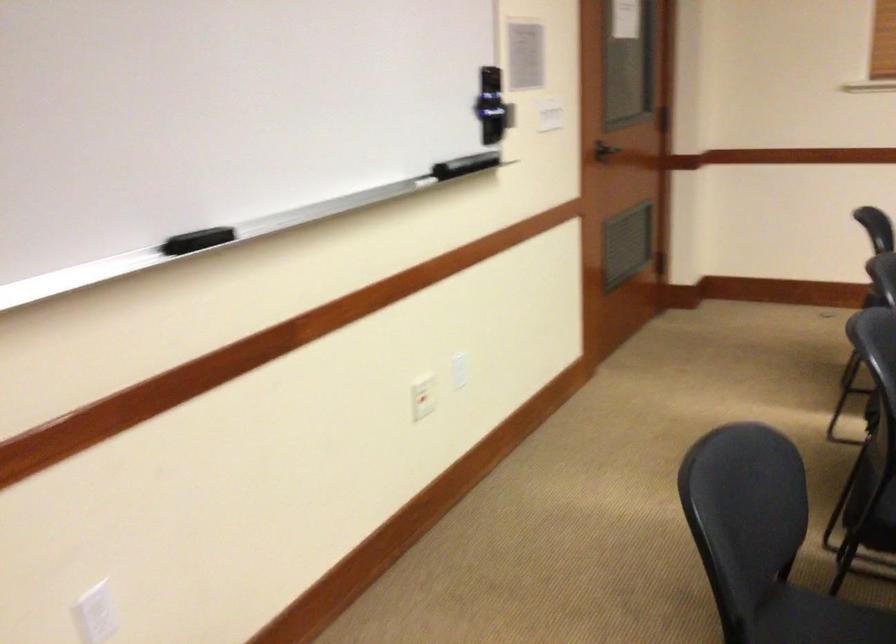
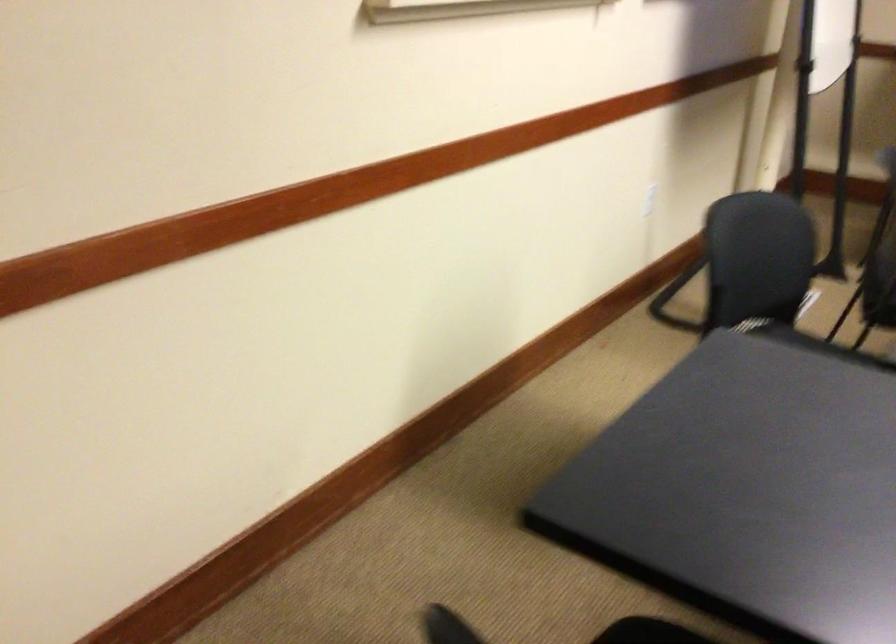
Question: What movement of the cameraman would produce the second image?

Choices:
 (A) Left
 (B) Right
 (C) Forward
 (D) Backward

Answer: (D)